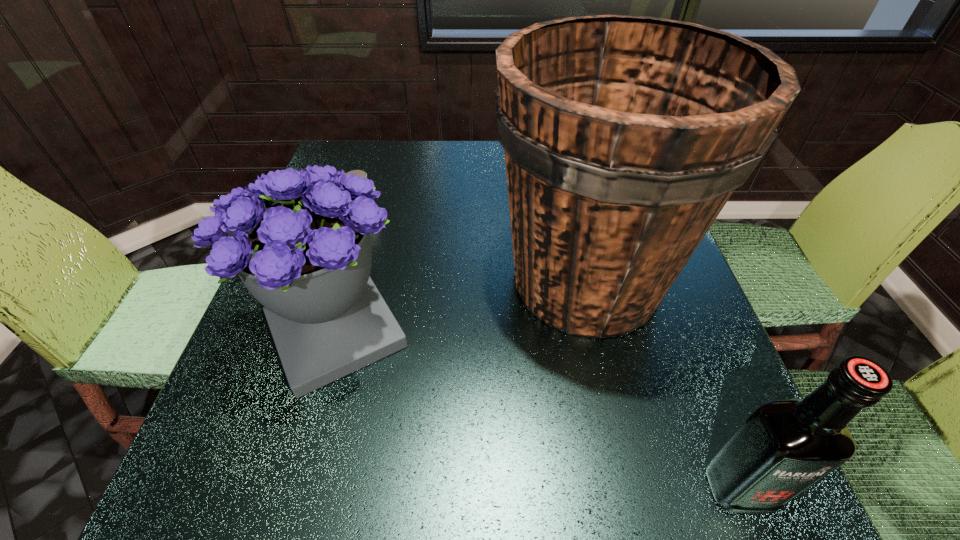
This screenshot has width=960, height=540. In order to click on the tallest object in this screenshot , I will do `click(624, 137)`.

Locate an element on the screen. This screenshot has height=540, width=960. bouquet is located at coordinates (299, 241).

Locate an element on the screen. Image resolution: width=960 pixels, height=540 pixels. liquor is located at coordinates (784, 447).

Identify the location of jam. The width and height of the screenshot is (960, 540). (361, 173).

Locate an element on the screen. This screenshot has height=540, width=960. vacant space located on the left of the tallest object is located at coordinates (373, 280).

Identify the location of free spot located 0.060m on the right of the bouquet. This screenshot has width=960, height=540. (441, 332).

Where is `free location located on the label side of the shortest object`? This screenshot has height=540, width=960. free location located on the label side of the shortest object is located at coordinates pos(354,246).

The image size is (960, 540). Find the location of `object located in the near edge section of the desktop`. object located in the near edge section of the desktop is located at coordinates click(784, 447).

Where is `bouquet located at the left edge`? The width and height of the screenshot is (960, 540). bouquet located at the left edge is located at coordinates (299, 241).

This screenshot has height=540, width=960. In order to click on jam at the left edge in this screenshot , I will do `click(361, 173)`.